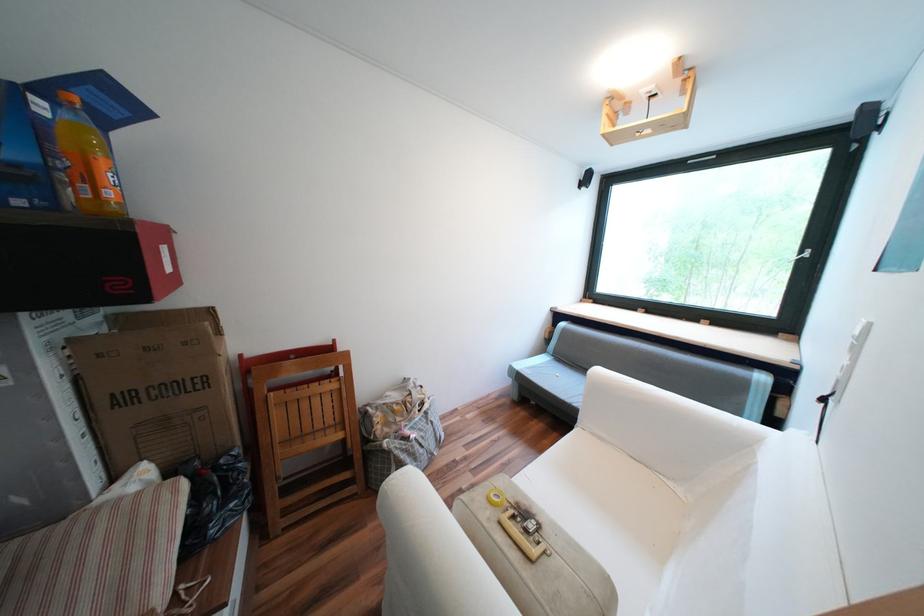
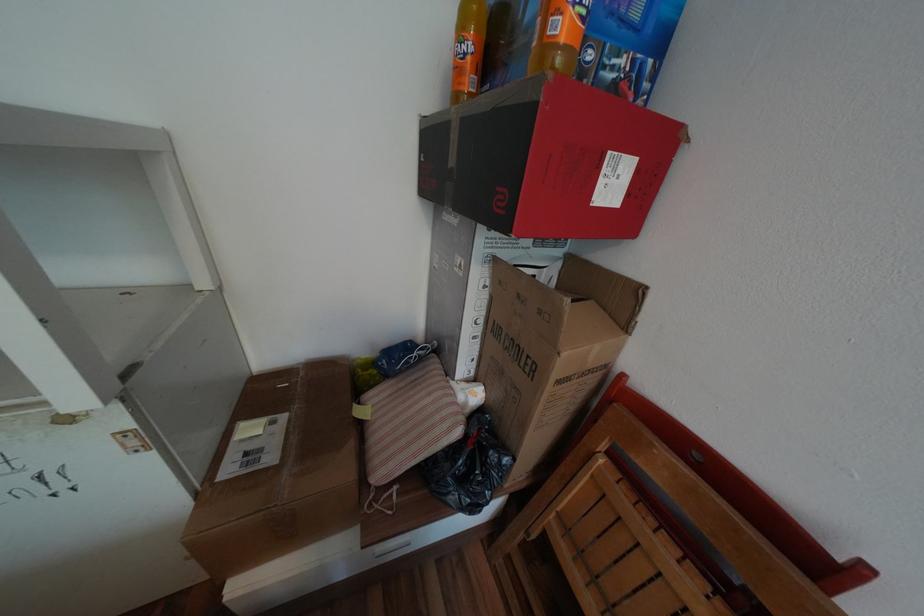
Based on the continuous images, in which direction is the camera rotating?

The camera's rotation is toward left-down.